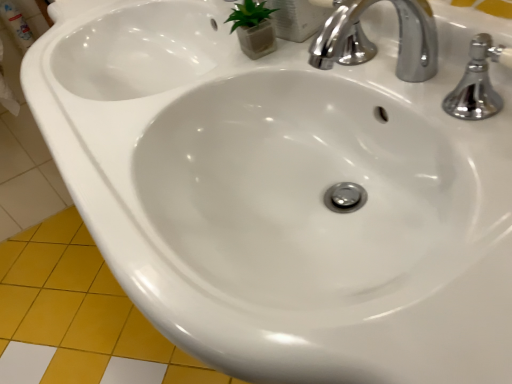
Question: From a real-world perspective, is yellow matte tile at lower left above or below polished chrome faucet at upper right?

Choices:
 (A) above
 (B) below

Answer: (B)

Question: Is yellow matte tile at lower left bigger or smaller than polished chrome faucet at upper right?

Choices:
 (A) big
 (B) small

Answer: (A)

Question: Is yellow matte tile at lower left taller or shorter than polished chrome faucet at upper right?

Choices:
 (A) tall
 (B) short

Answer: (B)

Question: In terms of width, does polished chrome faucet at upper right look wider or thinner when compared to yellow matte tile at lower left?

Choices:
 (A) wide
 (B) thin

Answer: (B)

Question: Considering the relative positions of polished chrome faucet at upper right and yellow matte tile at lower left in the image provided, is polished chrome faucet at upper right to the left or to the right of yellow matte tile at lower left?

Choices:
 (A) right
 (B) left

Answer: (A)

Question: From the image's perspective, is polished chrome faucet at upper right above or below yellow matte tile at lower left?

Choices:
 (A) above
 (B) below

Answer: (A)

Question: Considering the positions of polished chrome faucet at upper right and yellow matte tile at lower left in the image, is polished chrome faucet at upper right bigger or smaller than yellow matte tile at lower left?

Choices:
 (A) small
 (B) big

Answer: (A)